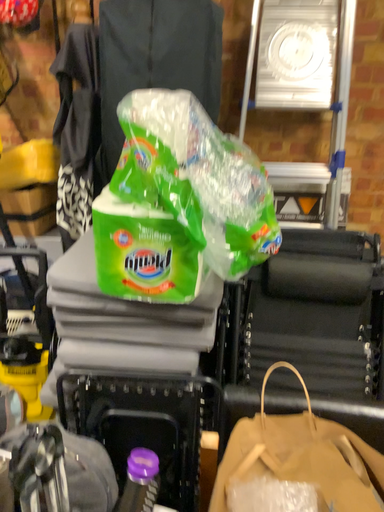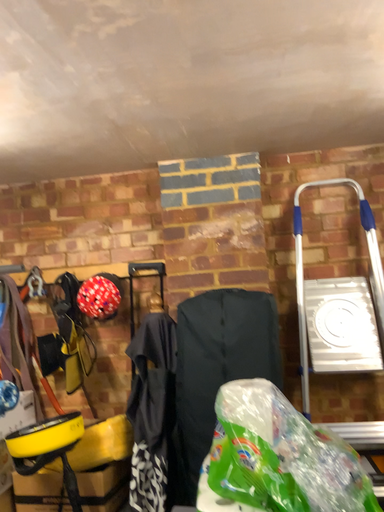
Question: Which way did the camera rotate in the video?

Choices:
 (A) rotated upward
 (B) rotated downward

Answer: (A)